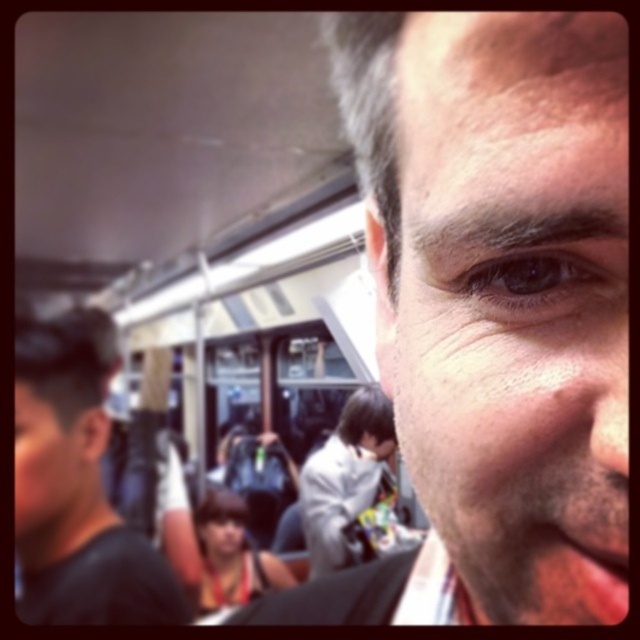
Does point (67, 580) lie in front of point (96, 468)?

That is True.

Looking at this image, between black matte shirt at left and matte black face at lower left, which one has more height?

With more height is black matte shirt at left.

The height and width of the screenshot is (640, 640). What do you see at coordinates (76, 484) in the screenshot? I see `black matte shirt at left` at bounding box center [76, 484].

Locate an element on the screen. The width and height of the screenshot is (640, 640). black matte shirt at left is located at coordinates (76, 484).

Can you confirm if black matte shirt at left is shorter than brown matte eye at center?

In fact, black matte shirt at left may be taller than brown matte eye at center.

Is black matte shirt at left positioned behind brown matte eye at center?

Yes, it is.

At what (x,y) coordinates should I click in order to perform the action: click on black matte shirt at left. Please return your answer as a coordinate pair (x, y). This screenshot has height=640, width=640. Looking at the image, I should click on (76, 484).

Can you confirm if black matte shirt at left is positioned to the left of smooth skin face at center?

No, black matte shirt at left is not to the left of smooth skin face at center.

Does black matte shirt at left appear under smooth skin face at center?

Actually, black matte shirt at left is above smooth skin face at center.

Where is `black matte shirt at left`? The width and height of the screenshot is (640, 640). black matte shirt at left is located at coordinates (76, 484).

You are a GUI agent. You are given a task and a screenshot of the screen. Output one action in this format:
    pyautogui.click(x=<x>, y=<y>)
    Task: Click on the black matte shirt at left
    This screenshot has height=640, width=640.
    Given the screenshot: What is the action you would take?
    pyautogui.click(x=76, y=484)